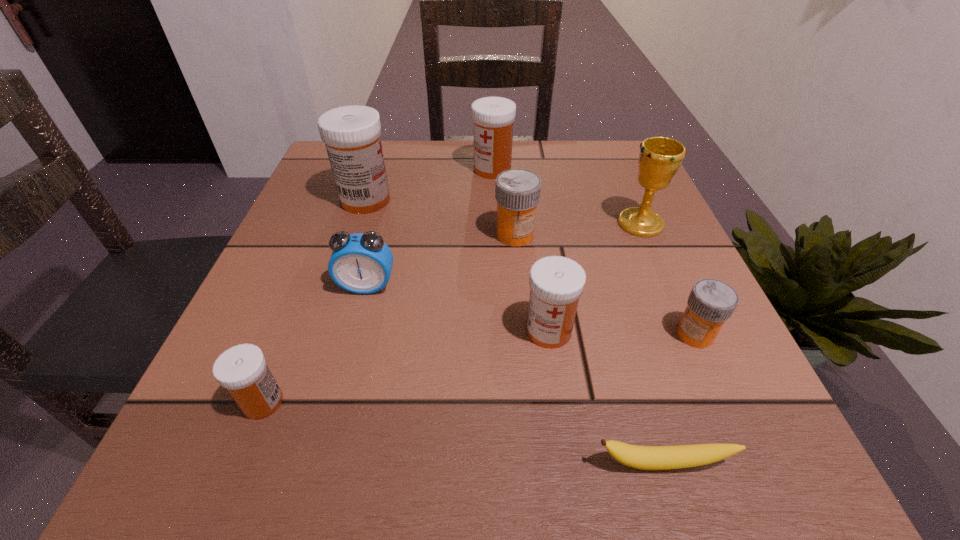
Where is `object that is positioned at the far left corner`? This screenshot has width=960, height=540. object that is positioned at the far left corner is located at coordinates (351, 133).

The width and height of the screenshot is (960, 540). In order to click on object that is at the near right corner in this screenshot , I will do `click(639, 457)`.

At what (x,y) coordinates should I click in order to perform the action: click on vacant region at the far edge of the desktop. Please return your answer as a coordinate pair (x, y). Looking at the image, I should click on (428, 195).

Where is `vacant area at the near edge of the desktop`? Image resolution: width=960 pixels, height=540 pixels. vacant area at the near edge of the desktop is located at coordinates (318, 424).

The width and height of the screenshot is (960, 540). I want to click on vacant space at the left edge, so click(328, 313).

At what (x,y) coordinates should I click in order to perform the action: click on vacant area at the right edge of the desktop. Please return your answer as a coordinate pair (x, y). The height and width of the screenshot is (540, 960). Looking at the image, I should click on (601, 204).

Identify the location of vacant space at the far left corner of the desktop. (329, 168).

In the image, there is a desktop. Where is `vacant space at the far right corner`? vacant space at the far right corner is located at coordinates (605, 144).

Find the location of a particular element. The image size is (960, 540). vacant space that is in between the smaller orange medicine and the third farthest white medicine is located at coordinates (622, 333).

Where is `free area in between the third farthest white medicine and the fifth shortest medicine`? The image size is (960, 540). free area in between the third farthest white medicine and the fifth shortest medicine is located at coordinates (520, 250).